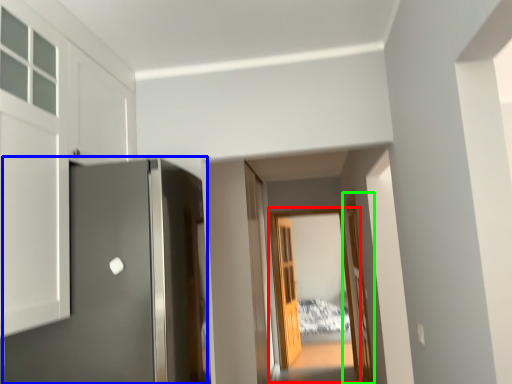
Question: Which object is the closest to the glass door (highlighted by a red box)? Choose among these: door (highlighted by a blue box) or door (highlighted by a green box).

Choices:
 (A) door
 (B) door

Answer: (B)